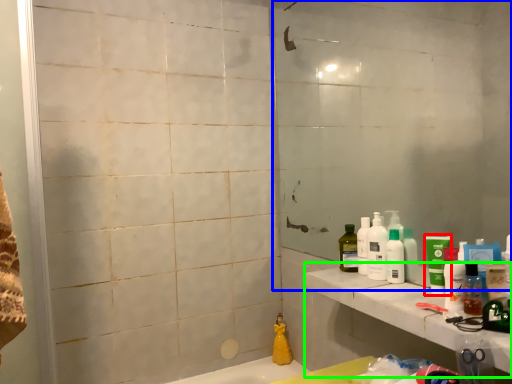
Question: Which is nearer to the mouthwash (highlighted by a red box)? mirror (highlighted by a blue box) or counter top (highlighted by a green box).

Choices:
 (A) mirror
 (B) counter top

Answer: (B)